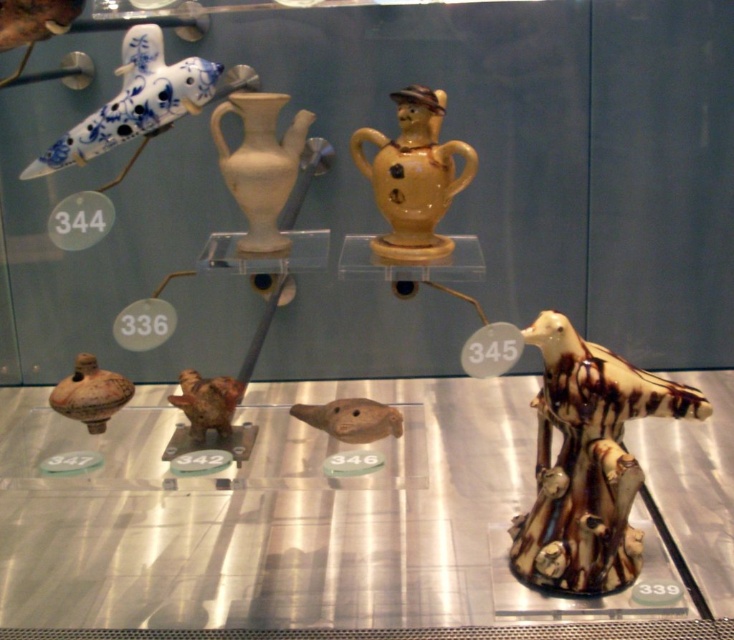
What is the 2D coordinate of the translucent glass table at lower center?

The translucent glass table at lower center is located at the 2D coordinate point of (265, 516).

You are a museum curator arranging items in the display case. You have a translucent glass table at lower center and a blue and white glazed bird at upper left. Which object should you place closer to the center of the case to ensure it is more visible to visitors?

The translucent glass table at lower center is larger in size than the blue and white glazed bird at upper left, so placing it closer to the center of the case would make it more visible to visitors due to its size.